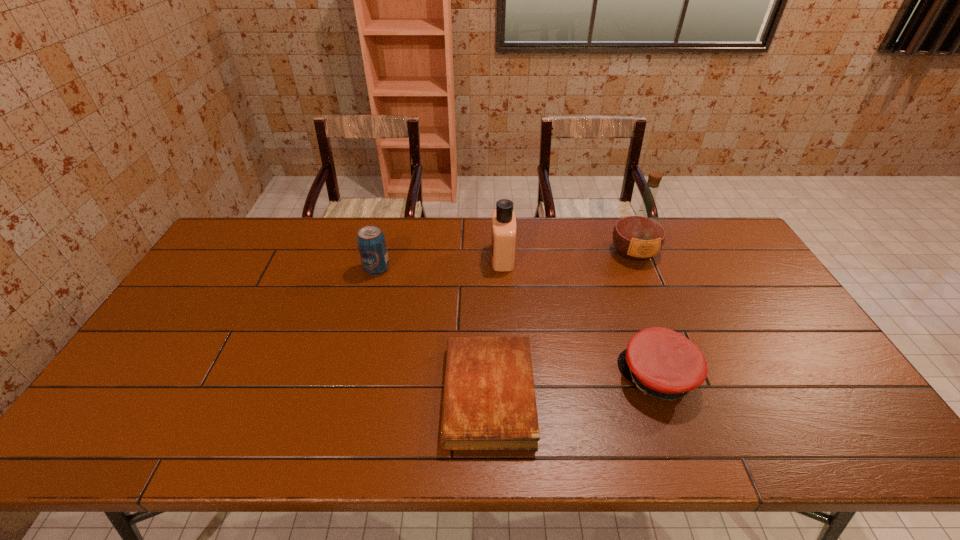
Find the location of `free space located 0.220m on the back of the pop soda`. free space located 0.220m on the back of the pop soda is located at coordinates (389, 222).

I want to click on free point located 0.140m on the front-facing side of the cap, so click(x=565, y=377).

Find the location of a particular element. The height and width of the screenshot is (540, 960). vacant space located 0.340m on the front-facing side of the cap is located at coordinates (488, 377).

Locate an element on the screen. This screenshot has height=540, width=960. vacant area situated on the front-facing side of the cap is located at coordinates (515, 377).

You are a GUI agent. You are given a task and a screenshot of the screen. Output one action in this format:
    pyautogui.click(x=<x>, y=<y>)
    Task: Click on the vacant space situated on the spine side of the shortest object
    Image resolution: width=960 pixels, height=540 pixels.
    Given the screenshot: What is the action you would take?
    pyautogui.click(x=364, y=395)

The image size is (960, 540). In order to click on vacant region located on the spine side of the shortest object in this screenshot , I will do `click(307, 395)`.

Where is `vacant region located on the spine side of the shortest object`? vacant region located on the spine side of the shortest object is located at coordinates (311, 395).

I want to click on liquor that is at the far edge, so click(639, 235).

Find the location of `perfume present at the far edge`. perfume present at the far edge is located at coordinates (503, 233).

You are a GUI agent. You are given a task and a screenshot of the screen. Output one action in this format:
    pyautogui.click(x=<x>, y=<y>)
    Task: Click on the object positioned at the near edge
    The height and width of the screenshot is (540, 960).
    Given the screenshot: What is the action you would take?
    pyautogui.click(x=489, y=403)